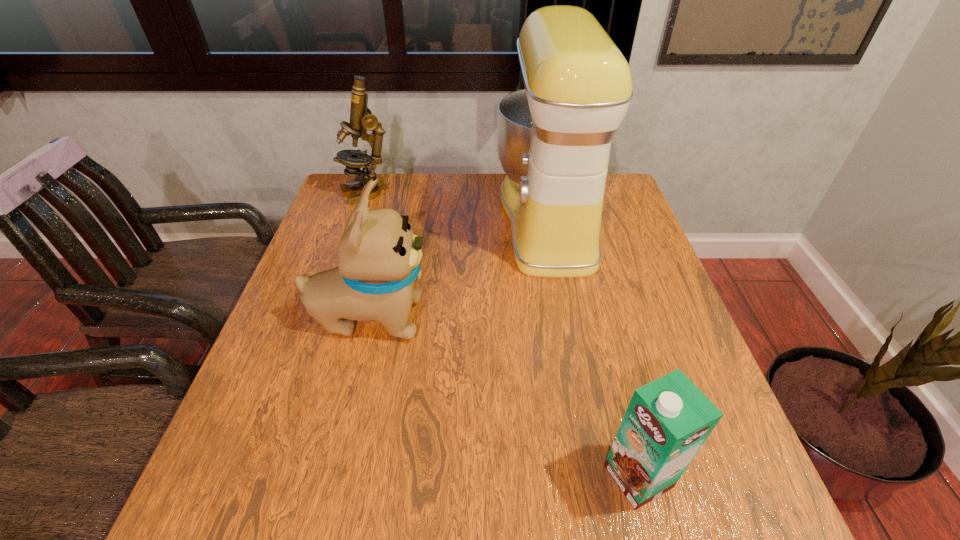
This screenshot has width=960, height=540. I want to click on free space in the image that satisfies the following two spatial constraints: 1. on the back side of the shortest object; 2. on the face of the third farthest object, so click(597, 318).

Identify the location of free spot that satisfies the following two spatial constraints: 1. on the face of the nearest object; 2. on the left side of the puppy. This screenshot has height=540, width=960. (332, 476).

At what (x,y) coordinates should I click in order to perform the action: click on vacant area in the image that satisfies the following two spatial constraints: 1. on the side of the carton with the control knob; 2. on the left side of the tallest object. Please return your answer as a coordinate pair (x, y). The height and width of the screenshot is (540, 960). Looking at the image, I should click on (598, 476).

Find the location of a particular element. vacant position in the image that satisfies the following two spatial constraints: 1. on the side of the mixer with the control knob; 2. on the left side of the shortest object is located at coordinates (598, 476).

In order to click on vacant area in the image that satisfies the following two spatial constraints: 1. on the face of the carton; 2. on the left side of the puppy in this screenshot , I will do `click(332, 476)`.

Locate an element on the screen. vacant space that satisfies the following two spatial constraints: 1. on the face of the shortest object; 2. on the right side of the puppy is located at coordinates (332, 476).

The image size is (960, 540). Identify the location of blank space that satisfies the following two spatial constraints: 1. on the back side of the carton; 2. on the face of the second nearest object. (597, 318).